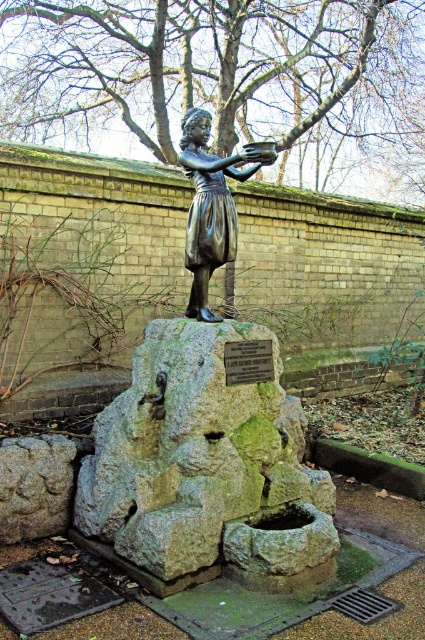
Question: Which point appears farthest from the camera in this image?

Choices:
 (A) (234, 173)
 (B) (153, 388)

Answer: (A)

Question: Does shiny bronze statue at center have a larger size compared to bronze statue at center?

Choices:
 (A) no
 (B) yes

Answer: (B)

Question: Does shiny bronze statue at center appear over bronze statue at center?

Choices:
 (A) no
 (B) yes

Answer: (A)

Question: Which object is closer to the camera taking this photo?

Choices:
 (A) shiny bronze statue at center
 (B) bronze statue at center

Answer: (A)

Question: Considering the relative positions of shiny bronze statue at center and bronze statue at center in the image provided, where is shiny bronze statue at center located with respect to bronze statue at center?

Choices:
 (A) above
 (B) below

Answer: (B)